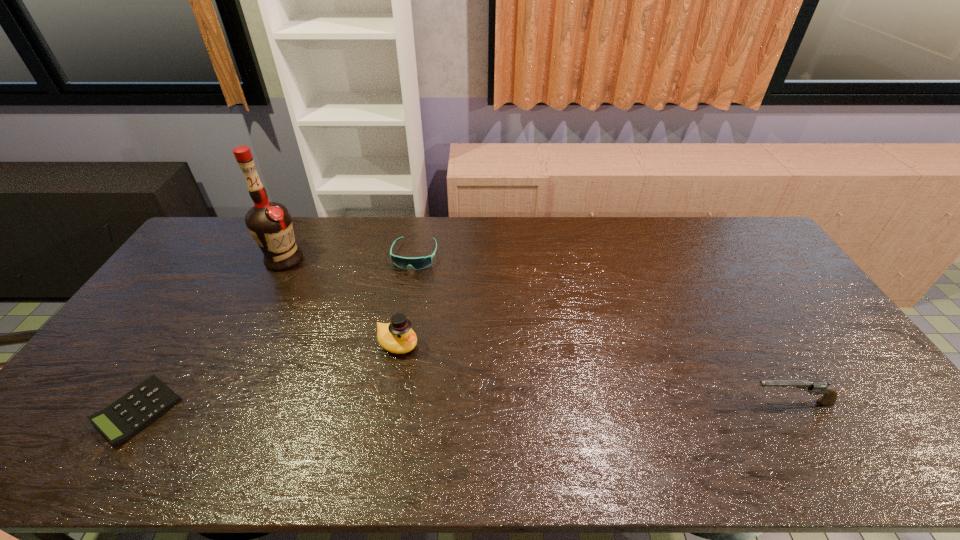
Find the location of a particular element. This screenshot has height=540, width=960. vacant space located 0.390m aiming along the barrel of the third shortest object is located at coordinates (593, 402).

Identify the location of vacant space situated aiming along the barrel of the third shortest object. (597, 402).

I want to click on vacant space located 0.210m aiming along the barrel of the third shortest object, so (x=664, y=402).

Identify the location of free space located 0.130m on the front-facing side of the second tallest object. (451, 374).

The width and height of the screenshot is (960, 540). In order to click on vacant space located on the front-facing side of the second tallest object in this screenshot , I will do (461, 379).

Image resolution: width=960 pixels, height=540 pixels. Find the location of `free space located 0.070m on the front-facing side of the second tallest object`. free space located 0.070m on the front-facing side of the second tallest object is located at coordinates (434, 363).

The width and height of the screenshot is (960, 540). In order to click on free spot located on the front and back of the liquor in this screenshot , I will do `click(301, 285)`.

In order to click on vacant position located on the front and back of the liquor in this screenshot , I will do `click(298, 280)`.

I want to click on free space located on the front and back of the liquor, so click(324, 316).

At what (x,y) coordinates should I click in order to perform the action: click on vacant space located 0.240m on the front-facing side of the sunglasses. Please return your answer as a coordinate pair (x, y). Looking at the image, I should click on (396, 325).